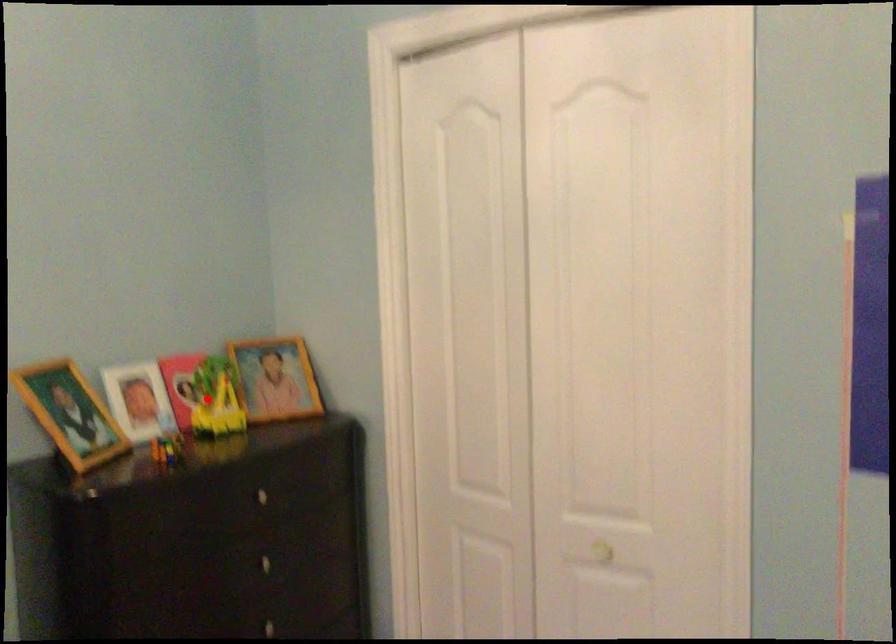
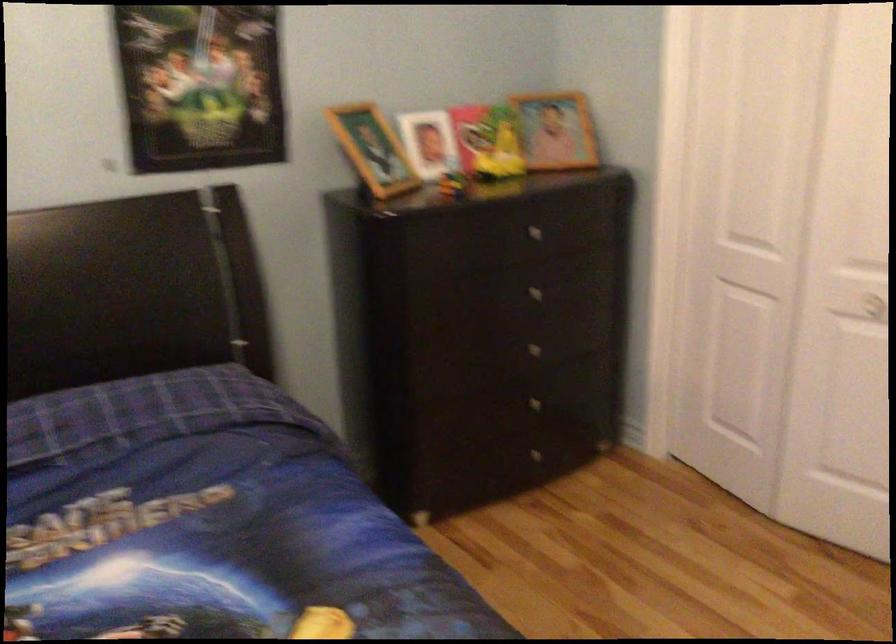
In the second image, find the point that corresponds to the highlighted location in the first image.

(487, 142)